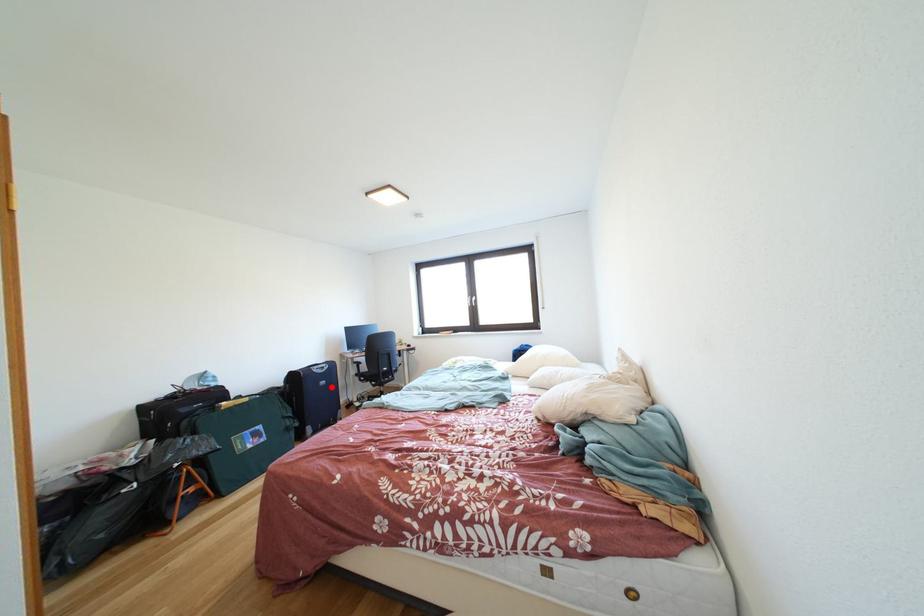
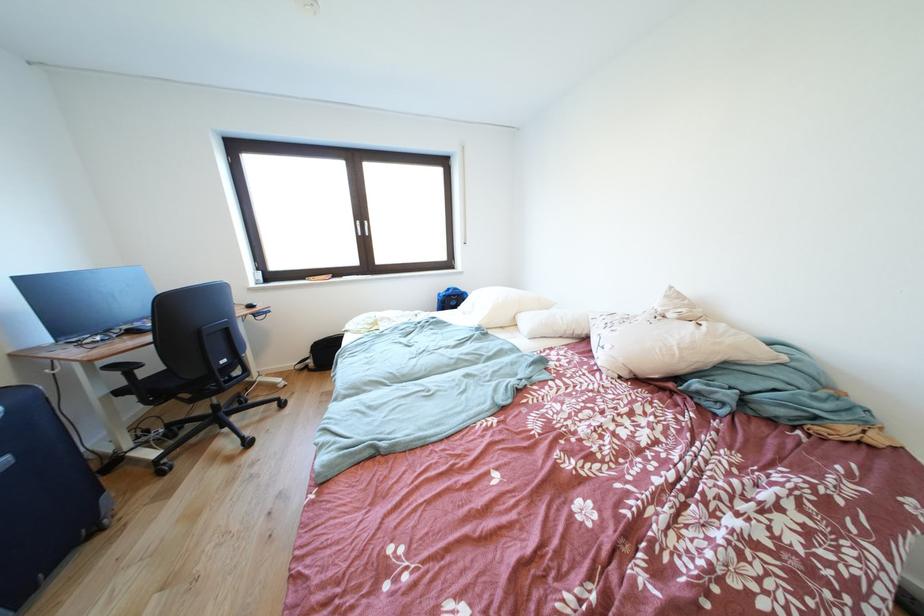
Question: I am providing you with two images of the same scene from different viewpoints. A red point is shown in image1. For the corresponding object point in image2, is it positioned nearer or farther from the camera?

Choices:
 (A) Nearer
 (B) Farther

Answer: (B)